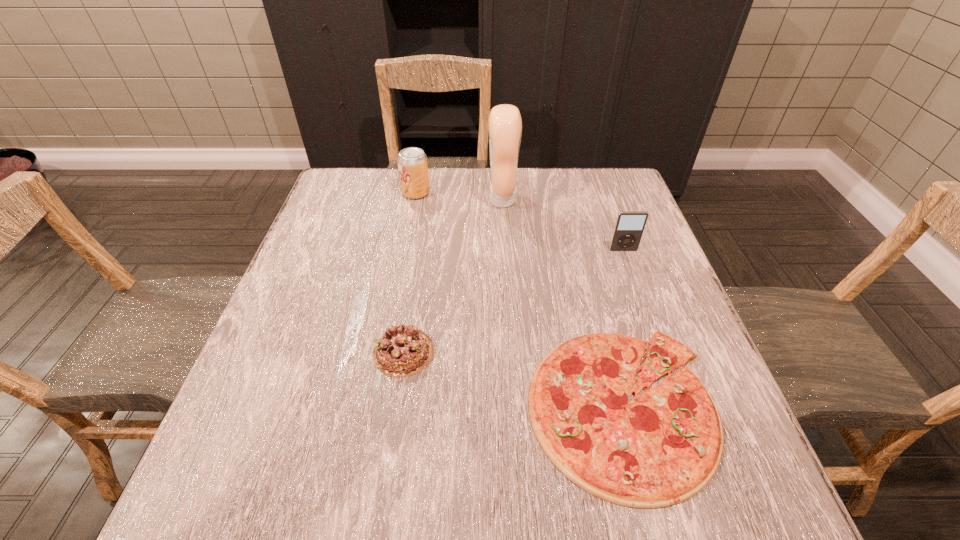
At what (x,y) coordinates should I click in order to perform the action: click on condiment. Please return your answer as a coordinate pair (x, y). Image resolution: width=960 pixels, height=540 pixels. Looking at the image, I should click on (505, 123).

This screenshot has height=540, width=960. Find the location of `pop (soda)`. pop (soda) is located at coordinates (412, 162).

Identify the location of iPod. This screenshot has width=960, height=540. (629, 226).

Where is `chocolate cake`? This screenshot has height=540, width=960. chocolate cake is located at coordinates (403, 350).

The width and height of the screenshot is (960, 540). Find the location of `the shortest object`. the shortest object is located at coordinates (663, 447).

This screenshot has height=540, width=960. What are the coordinates of `free space located 0.150m on the label of the condiment` in the screenshot? It's located at (434, 200).

The image size is (960, 540). What are the coordinates of `vacant space situated on the label of the condiment` in the screenshot? It's located at (398, 200).

The width and height of the screenshot is (960, 540). What are the coordinates of `blank space located 0.080m on the label of the condiment` in the screenshot? It's located at (459, 200).

Identify the location of free spot located on the right of the pop (soda). The width and height of the screenshot is (960, 540). (535, 193).

At what (x,y) coordinates should I click in order to perform the action: click on vacant area situated 0.320m on the front-facing side of the iPod. Please return your answer as a coordinate pair (x, y). The width and height of the screenshot is (960, 540). Looking at the image, I should click on (662, 360).